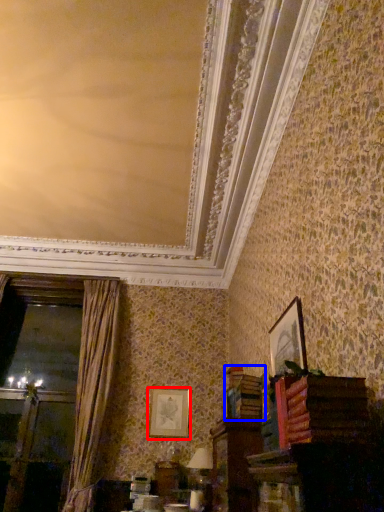
Question: Among these objects, which one is nearest to the camera, picture frame (highlighted by a red box) or book (highlighted by a blue box)?

Choices:
 (A) picture frame
 (B) book

Answer: (B)